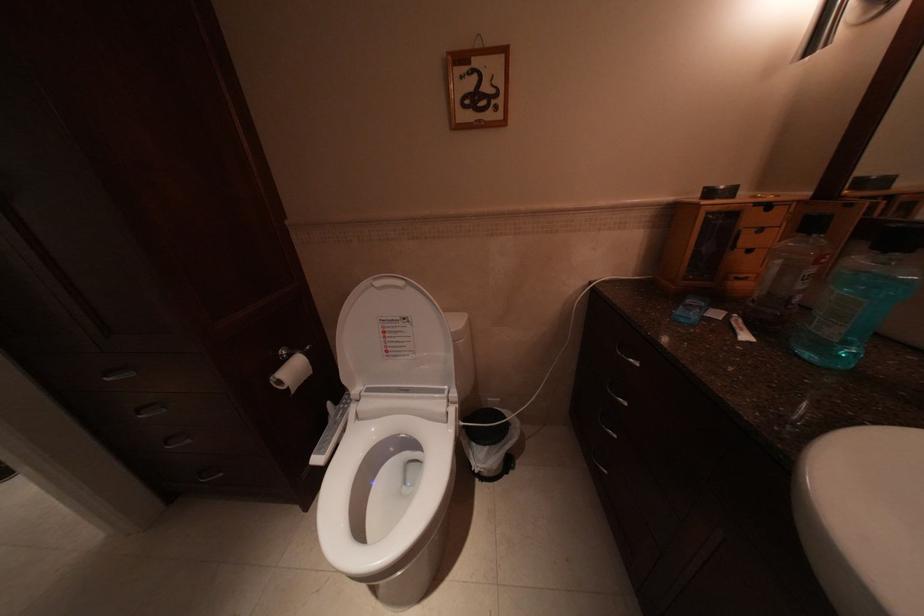
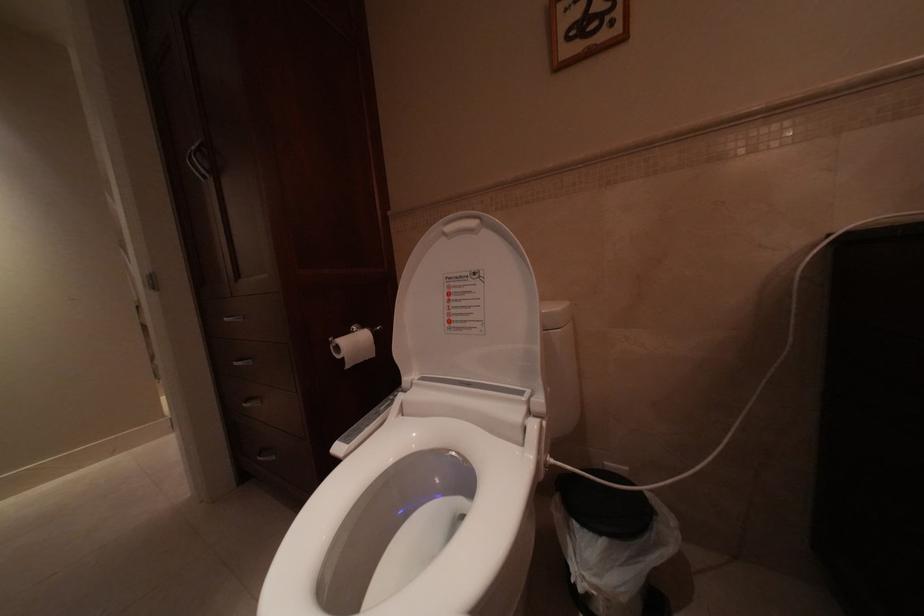
Question: Which direction would the cameraman need to move to produce the second image? Reply with the corresponding letter.

Choices:
 (A) Left
 (B) Right
 (C) Forward
 (D) Backward

Answer: (C)